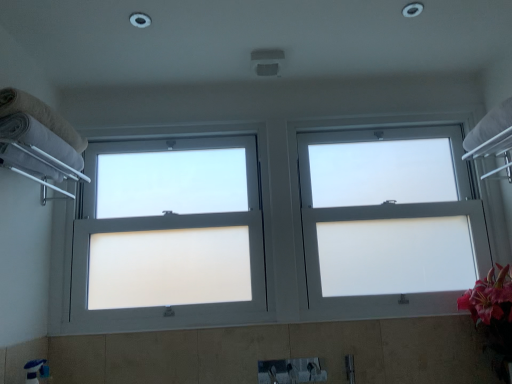
Question: Considering the relative sizes of white fluffy towel at left, the second towel from the top, and white frosted glass window at center, which is the first window from right to left, in the image provided, is white fluffy towel at left, the second towel from the top, taller than white frosted glass window at center, which is the first window from right to left,?

Choices:
 (A) yes
 (B) no

Answer: (B)

Question: Is white fluffy towel at left, the first towel positioned from the bottom, to the right of white frosted glass window at center, which is the first window from right to left, from the viewer's perspective?

Choices:
 (A) yes
 (B) no

Answer: (B)

Question: Is white fluffy towel at left, the second towel from the top, looking in the opposite direction of white frosted glass window at center, the 2th window when ordered from left to right?

Choices:
 (A) no
 (B) yes

Answer: (A)

Question: Does white fluffy towel at left, the second towel from the top, touch white frosted glass window at center, which is the first window from right to left?

Choices:
 (A) no
 (B) yes

Answer: (A)

Question: Is white fluffy towel at left, the first towel positioned from the bottom, to the left of white frosted glass window at center, the 2th window when ordered from left to right, from the viewer's perspective?

Choices:
 (A) yes
 (B) no

Answer: (A)

Question: Does white fluffy towel at left, the first towel positioned from the bottom, have a larger size compared to white frosted glass window at center, the 2th window when ordered from left to right?

Choices:
 (A) yes
 (B) no

Answer: (B)

Question: From a real-world perspective, does white frosted glass window at center, which is the first window from right to left, sit lower than white fluffy towel at left, the second towel from the top?

Choices:
 (A) yes
 (B) no

Answer: (A)

Question: Does white frosted glass window at center, which is the first window from right to left, have a smaller size compared to white fluffy towel at left, the second towel from the top?

Choices:
 (A) no
 (B) yes

Answer: (A)

Question: Is white frosted glass window at center, which is the first window from right to left, far from white fluffy towel at left, the first towel positioned from the bottom?

Choices:
 (A) no
 (B) yes

Answer: (B)

Question: Is white frosted glass window at center, the 2th window when ordered from left to right, placed right next to white fluffy towel at left, the second towel from the top?

Choices:
 (A) yes
 (B) no

Answer: (B)

Question: Is white frosted glass window at center, which is the first window from right to left, bigger than white fluffy towel at left, the first towel positioned from the bottom?

Choices:
 (A) no
 (B) yes

Answer: (B)

Question: Would you say white frosted glass window at center, which is the first window from right to left, is outside white fluffy towel at left, the first towel positioned from the bottom?

Choices:
 (A) no
 (B) yes

Answer: (B)

Question: Does white frosted glass window at center, the 2th window when ordered from left to right, come behind beige cotton towel at left, positioned as the 2th towel in bottom-to-top order?

Choices:
 (A) yes
 (B) no

Answer: (A)